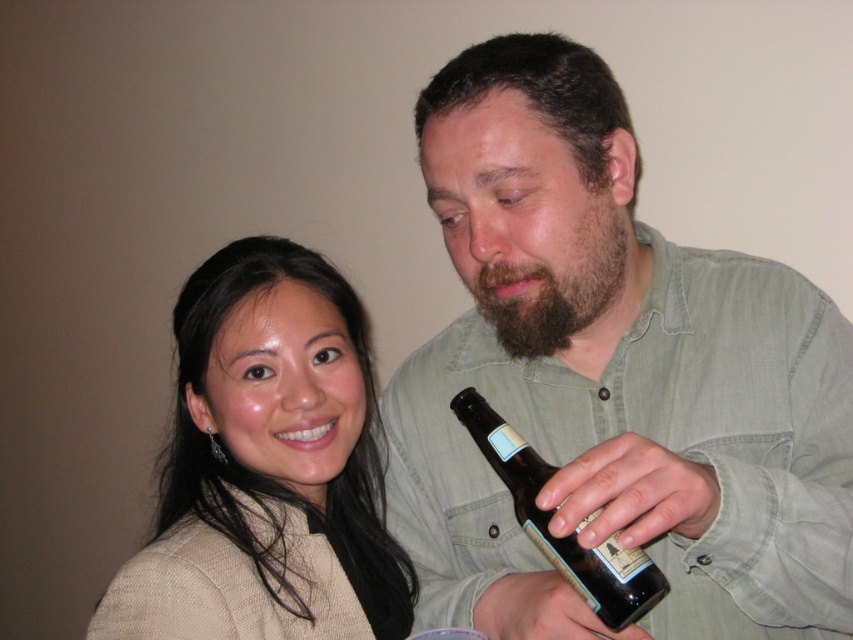
Does brown matte bottle at center have a larger size compared to matte beige sweater at upper left?

Indeed, brown matte bottle at center has a larger size compared to matte beige sweater at upper left.

Where is `brown matte bottle at center`? brown matte bottle at center is located at coordinates (612, 380).

Can you confirm if brown matte bottle at center is taller than brown glass bottle at center?

Yes, brown matte bottle at center is taller than brown glass bottle at center.

Is brown matte bottle at center thinner than brown glass bottle at center?

Incorrect, brown matte bottle at center's width is not less than brown glass bottle at center's.

Which is behind, point (537, 595) or point (538, 538)?

The point (537, 595) is behind.

You are a GUI agent. You are given a task and a screenshot of the screen. Output one action in this format:
    pyautogui.click(x=<x>, y=<y>)
    Task: Click on the brown matte bottle at center
    This screenshot has width=853, height=640.
    Given the screenshot: What is the action you would take?
    pyautogui.click(x=612, y=380)

Does point (558, 333) come farther from viewer compared to point (653, 593)?

Yes, point (558, 333) is behind point (653, 593).

Can you confirm if brown fuzzy beard at center is bigger than brown glass bottle at center?

No, brown fuzzy beard at center is not bigger than brown glass bottle at center.

Describe the element at coordinates (556, 282) in the screenshot. I see `brown fuzzy beard at center` at that location.

Where is `brown fuzzy beard at center`? The image size is (853, 640). brown fuzzy beard at center is located at coordinates (556, 282).